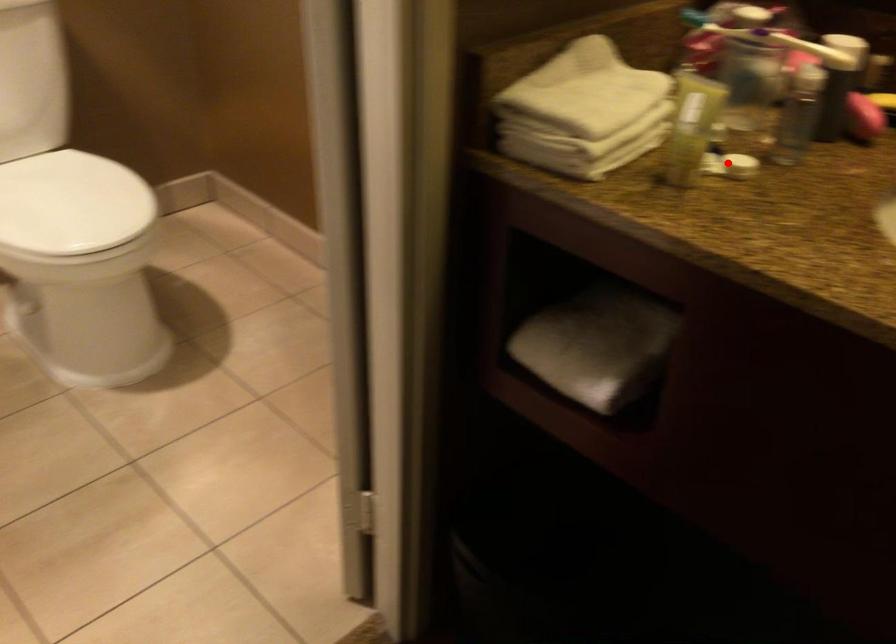
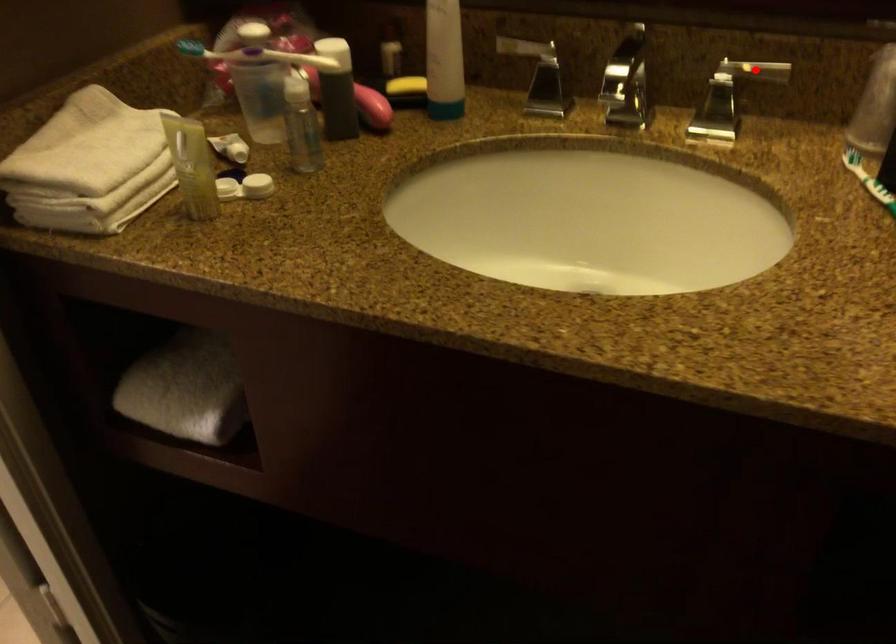
I am providing you with two images of the same scene from different viewpoints. A red point is marked on the first image and another point is marked on the second image. Is the marked point in image1 the same physical position as the marked point in image2?

No